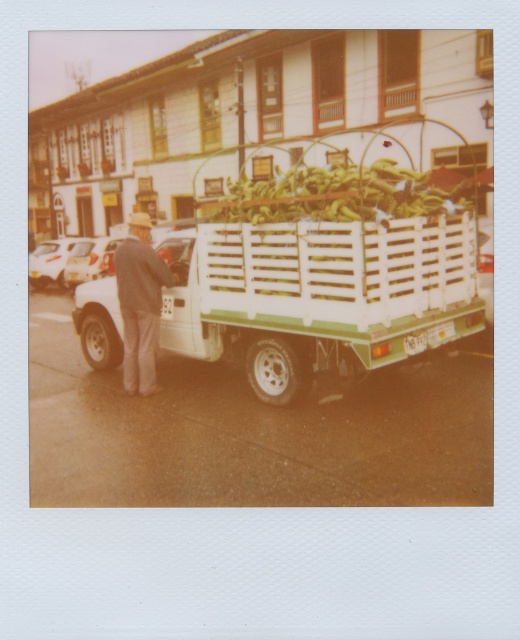
Question: Is white wooden crate at center further to the viewer compared to gray woolen jacket at left?

Choices:
 (A) no
 (B) yes

Answer: (A)

Question: Which object is farther from the camera taking this photo?

Choices:
 (A) white wooden crate at center
 (B) gray woolen jacket at left

Answer: (B)

Question: Is white wooden crate at center further to camera compared to gray woolen jacket at left?

Choices:
 (A) yes
 (B) no

Answer: (B)

Question: Which object is farther from the camera taking this photo?

Choices:
 (A) gray woolen jacket at left
 (B) white wooden crate at center

Answer: (A)

Question: Is white wooden crate at center further to camera compared to gray woolen jacket at left?

Choices:
 (A) no
 (B) yes

Answer: (A)